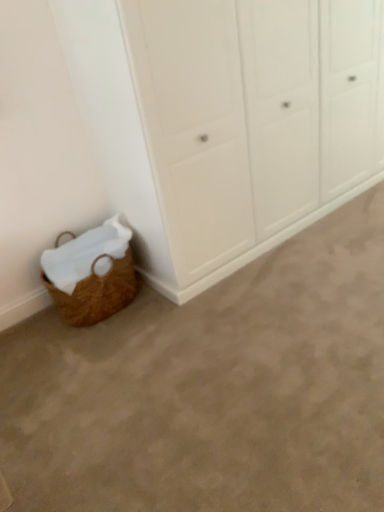
Question: Is brown woven basket at lower left smaller than white matte cupboard at lower left?

Choices:
 (A) no
 (B) yes

Answer: (B)

Question: Is brown woven basket at lower left next to white matte cupboard at lower left and touching it?

Choices:
 (A) no
 (B) yes

Answer: (A)

Question: Could you tell me if brown woven basket at lower left is facing white matte cupboard at lower left?

Choices:
 (A) yes
 (B) no

Answer: (B)

Question: From the image's perspective, is brown woven basket at lower left located above white matte cupboard at lower left?

Choices:
 (A) no
 (B) yes

Answer: (A)

Question: Considering the relative positions of brown woven basket at lower left and white matte cupboard at lower left in the image provided, is brown woven basket at lower left in front of white matte cupboard at lower left?

Choices:
 (A) no
 (B) yes

Answer: (A)

Question: Is brown woven basket at lower left to the left of white matte cupboard at lower left from the viewer's perspective?

Choices:
 (A) no
 (B) yes

Answer: (B)

Question: Is brown woven basket at lower left to the right of brown woven basket at lower left from the viewer's perspective?

Choices:
 (A) no
 (B) yes

Answer: (B)

Question: Could brown woven basket at lower left be considered to be inside brown woven basket at lower left?

Choices:
 (A) yes
 (B) no

Answer: (B)

Question: Is brown woven basket at lower left oriented away from brown woven basket at lower left?

Choices:
 (A) no
 (B) yes

Answer: (A)

Question: Is brown woven basket at lower left oriented towards brown woven basket at lower left?

Choices:
 (A) no
 (B) yes

Answer: (A)

Question: Is brown woven basket at lower left not near brown woven basket at lower left?

Choices:
 (A) yes
 (B) no

Answer: (B)

Question: Is brown woven basket at lower left in front of brown woven basket at lower left?

Choices:
 (A) no
 (B) yes

Answer: (B)

Question: Could you tell me if white matte cupboard at lower left is turned towards brown woven basket at lower left?

Choices:
 (A) yes
 (B) no

Answer: (A)